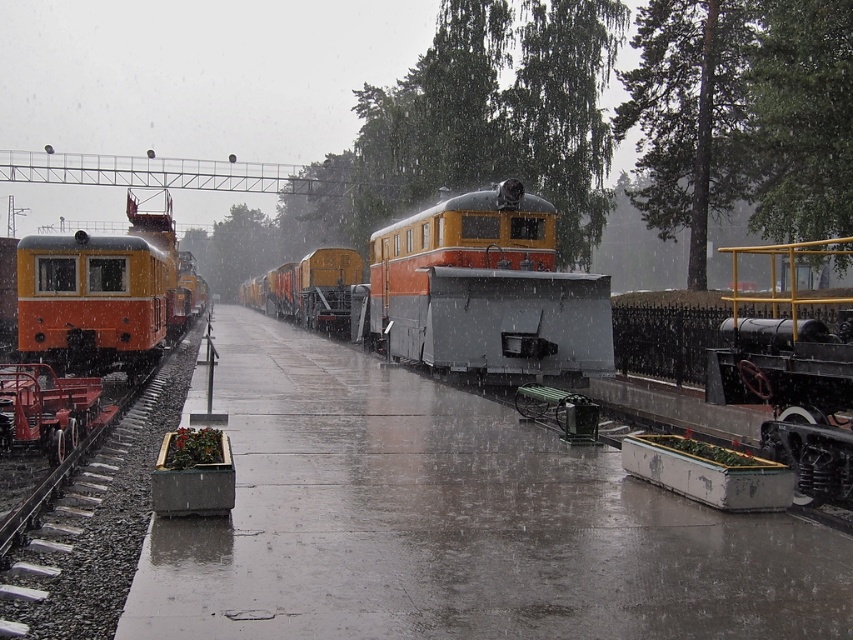
Question: Is orange matte train at center in front of orange matte train at left?

Choices:
 (A) yes
 (B) no

Answer: (A)

Question: Which point is farther to the camera?

Choices:
 (A) (39, 262)
 (B) (509, 381)

Answer: (A)

Question: Is orange matte train at center bigger than orange matte train at left?

Choices:
 (A) yes
 (B) no

Answer: (A)

Question: Does orange matte train at center have a lesser width compared to orange matte train at left?

Choices:
 (A) yes
 (B) no

Answer: (B)

Question: Which point is closer to the camera taking this photo?

Choices:
 (A) (140, 362)
 (B) (500, 221)

Answer: (B)

Question: Which point is closer to the camera taking this photo?

Choices:
 (A) (144, 316)
 (B) (498, 234)

Answer: (A)